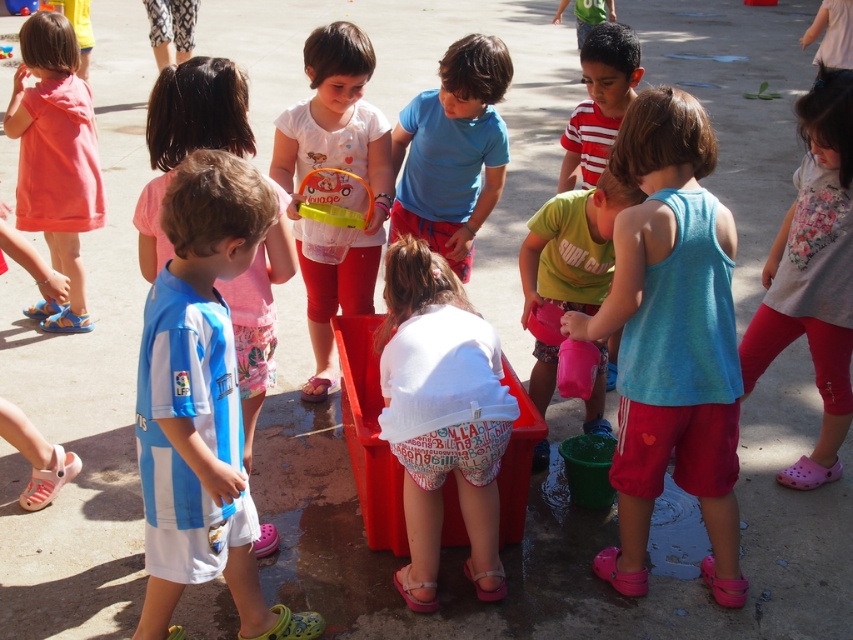
You are a photographer trying to capture a candid shot of the white cotton shirt at center and the pink fabric pants at lower right. Since you want to focus on both subjects equally, which clothing item should you adjust your camera angle to emphasize more?

The white cotton shirt at center occupies less space than pink fabric pants at lower right, so you should adjust your camera angle to emphasize the white cotton shirt at center to balance the composition.

In the scene with the blue cotton shirt at center and the striped cotton shirt at center, which child is wearing a larger shirt?

The blue cotton shirt at center is bigger than the striped cotton shirt at center.

You are a photographer trying to capture a candid shot of the blue cotton shirt at center and the striped cotton shirt at center. Since you want to ensure both are in the frame, can you confirm if they are positioned side by side horizontally?

The blue cotton shirt at center is to the left of striped cotton shirt at center, so they are positioned side by side horizontally.